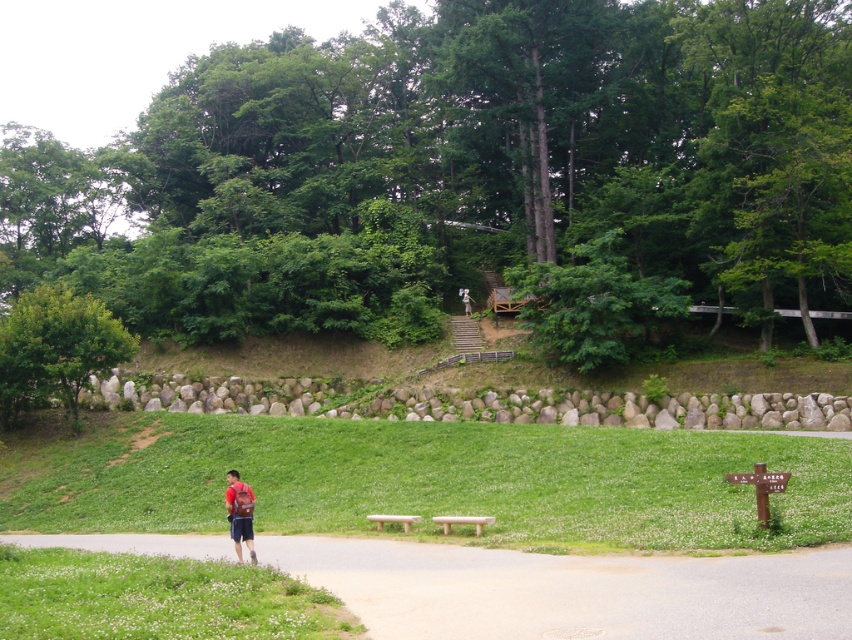
Locate an element on the screen. green leafy tree at left is located at coordinates (55, 348).

Does green leafy tree at left appear over matte red backpack at lower left?

Correct, green leafy tree at left is located above matte red backpack at lower left.

Is point (37, 294) positioned behind point (239, 515)?

Yes, it is.

Find the location of `green leafy tree at left`. green leafy tree at left is located at coordinates (55, 348).

Who is higher up, green grassy at lower center or gray asphalt path at center?

green grassy at lower center is higher up.

From the picture: Can you confirm if green grassy at lower center is wider than gray asphalt path at center?

Indeed, green grassy at lower center has a greater width compared to gray asphalt path at center.

Image resolution: width=852 pixels, height=640 pixels. I want to click on green grassy at lower center, so [421, 480].

Which is below, green grassy at lower center or green leafy tree at left?

green grassy at lower center is below.

You are a GUI agent. You are given a task and a screenshot of the screen. Output one action in this format:
    pyautogui.click(x=<x>, y=<y>)
    Task: Click on the green grassy at lower center
    
    Given the screenshot: What is the action you would take?
    click(x=421, y=480)

Identify the location of green grassy at lower center. tap(421, 480).